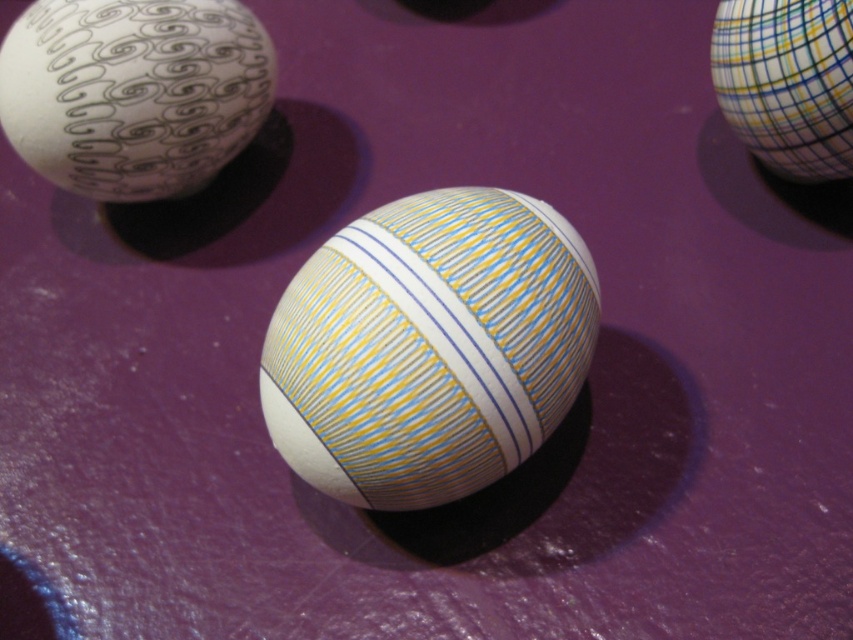
Does yellow striped egg at center appear on the left side of white matte egg at upper left?

No, yellow striped egg at center is not to the left of white matte egg at upper left.

Between yellow striped egg at center and white matte egg at upper left, which one is positioned higher?

white matte egg at upper left

Find the location of a particular element. The width and height of the screenshot is (853, 640). yellow striped egg at center is located at coordinates (428, 346).

Who is positioned more to the left, white matte egg at upper left or multicolored striped egg at upper right?

From the viewer's perspective, white matte egg at upper left appears more on the left side.

Where is `white matte egg at upper left`? This screenshot has width=853, height=640. white matte egg at upper left is located at coordinates (132, 92).

Locate an element on the screen. white matte egg at upper left is located at coordinates (132, 92).

Between yellow striped egg at center and multicolored striped egg at upper right, which one appears on the right side from the viewer's perspective?

multicolored striped egg at upper right is more to the right.

Is yellow striped egg at center bigger than multicolored striped egg at upper right?

Yes, yellow striped egg at center is bigger than multicolored striped egg at upper right.

Which is in front, point (409, 436) or point (738, 45)?

Positioned in front is point (409, 436).

Where is `yellow striped egg at center`? Image resolution: width=853 pixels, height=640 pixels. yellow striped egg at center is located at coordinates (428, 346).